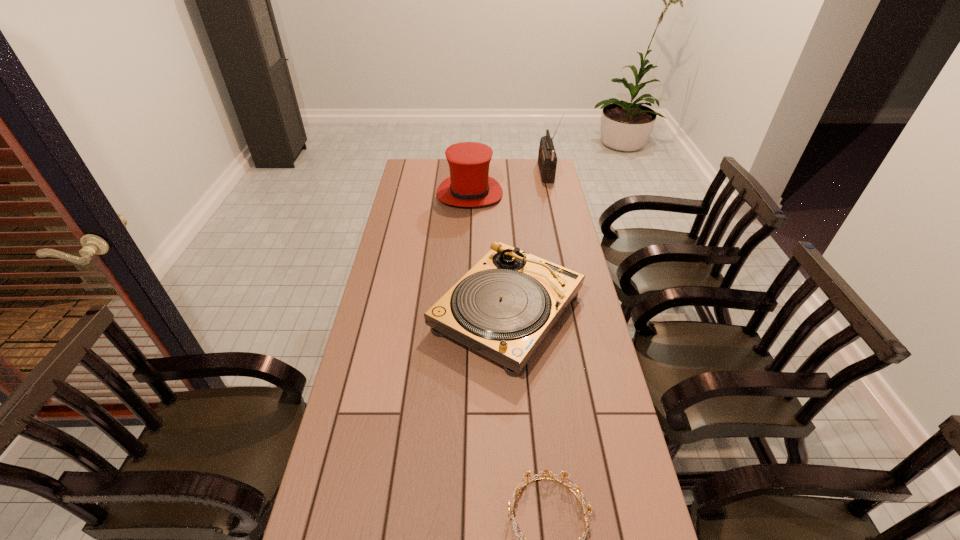
What are the coordinates of `hat situated at the far edge` in the screenshot? It's located at [x=469, y=185].

Locate an element on the screen. The height and width of the screenshot is (540, 960). radio receiver that is at the right edge is located at coordinates (x=547, y=159).

Where is `record player at the right edge`? The height and width of the screenshot is (540, 960). record player at the right edge is located at coordinates (506, 304).

Locate an element on the screen. The image size is (960, 540). object at the far right corner is located at coordinates (547, 159).

You are a GUI agent. You are given a task and a screenshot of the screen. Output one action in this format:
    pyautogui.click(x=<x>, y=<y>)
    Task: Click on the free location at the left edge
    The height and width of the screenshot is (540, 960).
    Given the screenshot: What is the action you would take?
    pyautogui.click(x=409, y=238)

Identify the location of free space at the right edge. (586, 325).

The height and width of the screenshot is (540, 960). In the image, there is a desktop. What are the coordinates of `vacant space at the far left corner` in the screenshot? It's located at (411, 170).

In the image, there is a desktop. Where is `free space at the far right corner`? The height and width of the screenshot is (540, 960). free space at the far right corner is located at coordinates (525, 181).

Locate an element on the screen. This screenshot has width=960, height=540. free space between the record player and the radio receiver is located at coordinates (527, 242).

The height and width of the screenshot is (540, 960). Find the location of `free space between the radio receiver and the record player`. free space between the radio receiver and the record player is located at coordinates (527, 242).